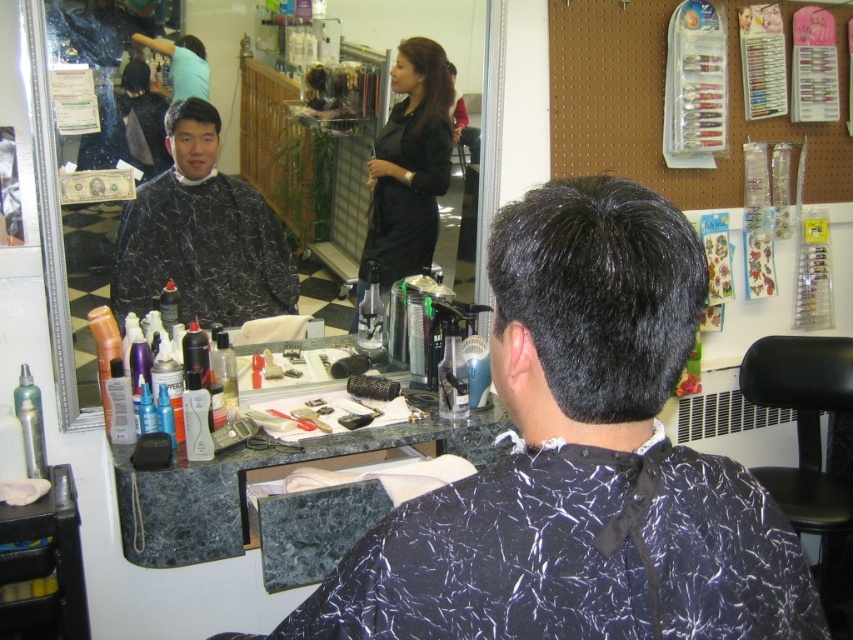
Is black satin dress at center taller than black marble hairdresser cape at upper left?

Yes.

Which is more to the left, black satin dress at center or black marble hairdresser cape at upper left?

Positioned to the left is black marble hairdresser cape at upper left.

Who is more distant from viewer, (393, 116) or (175, 122)?

Point (393, 116)

Where is `black satin dress at center`? black satin dress at center is located at coordinates (409, 166).

Is point (519, 289) behind point (426, 80)?

No, (519, 289) is in front of (426, 80).

Image resolution: width=853 pixels, height=640 pixels. Describe the element at coordinates (599, 292) in the screenshot. I see `black matte hair at center` at that location.

What do you see at coordinates (599, 292) in the screenshot? I see `black matte hair at center` at bounding box center [599, 292].

Identify the location of black matte hair at center. (x=599, y=292).

Who is positioned more to the left, black marbled barber cape at center or black marble hairdresser cape at upper left?

black marbled barber cape at center is more to the left.

This screenshot has width=853, height=640. What do you see at coordinates (201, 234) in the screenshot?
I see `black marbled barber cape at center` at bounding box center [201, 234].

Is point (250, 292) positioned before point (210, 109)?

No, it is behind (210, 109).

Where is `black marbled barber cape at center`? This screenshot has width=853, height=640. black marbled barber cape at center is located at coordinates (201, 234).